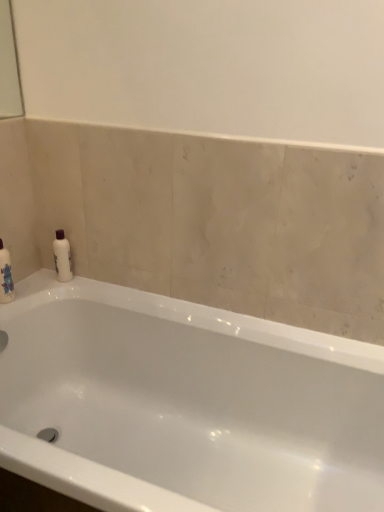
I want to click on vacant space to the right of white glossy bottle at upper left, so click(x=102, y=283).